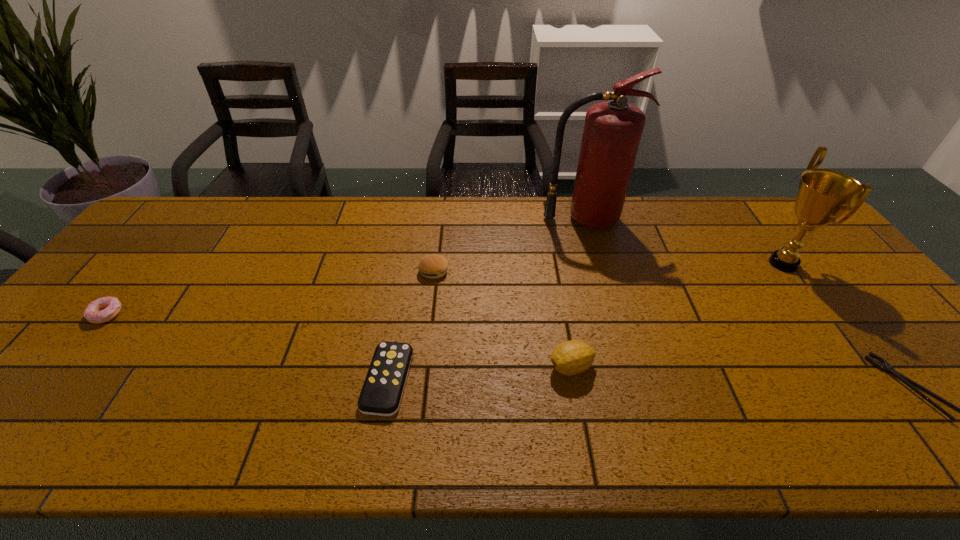
Locate an element on the screen. The height and width of the screenshot is (540, 960). vacant area that lies between the sixth tallest object and the patty is located at coordinates (411, 326).

Where is `free spot between the fourth shortest object and the tallest object`? This screenshot has height=540, width=960. free spot between the fourth shortest object and the tallest object is located at coordinates (510, 245).

Locate an element on the screen. The height and width of the screenshot is (540, 960). vacant area between the tallest object and the patty is located at coordinates (510, 245).

You are a GUI agent. You are given a task and a screenshot of the screen. Output one action in this format:
    pyautogui.click(x=<x>, y=<y>)
    Task: Click on the empty space between the patty and the fourth farthest object
    
    Given the screenshot: What is the action you would take?
    pyautogui.click(x=270, y=293)

Select which object is the fifth closest to the remote control. Please provide its 2D coordinates. Your answer should be formatted as a tuple, i.e. [(x, y)], where the tuple contains the x and y coordinates of a point satisfying the conditions above.

[(823, 195)]

Image resolution: width=960 pixels, height=540 pixels. I want to click on object that stands as the fourth closest to the leftmost object, so click(612, 132).

Identify the location of blank area in the image that satisfies the following two spatial constraints: 1. on the front view with handles of the award; 2. on the front side of the leftmost object. (821, 314).

Where is `vacant region that satisfies the following two spatial constraints: 1. at the front of the fire extinguisher where the nozzle is aimed; 2. at the stem end of the lemon`? This screenshot has height=540, width=960. vacant region that satisfies the following two spatial constraints: 1. at the front of the fire extinguisher where the nozzle is aimed; 2. at the stem end of the lemon is located at coordinates (627, 367).